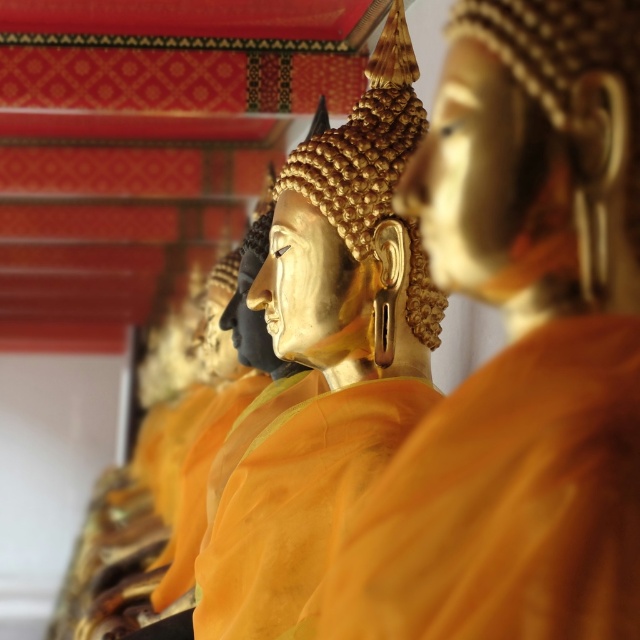
Question: Estimate the real-world distances between objects in this image. Which object is farther from the gold polished statue at center?

Choices:
 (A) matte orange fabric at center
 (B) gold shiny monk at center

Answer: (B)

Question: From the image, what is the correct spatial relationship of gold shiny monk at center in relation to matte orange fabric at center?

Choices:
 (A) right
 (B) left

Answer: (A)

Question: Is gold shiny monk at center thinner than matte orange fabric at center?

Choices:
 (A) yes
 (B) no

Answer: (A)

Question: Which of these objects is positioned farthest from the gold polished statue at center?

Choices:
 (A) matte orange fabric at center
 (B) gold shiny monk at center

Answer: (B)

Question: Is gold shiny monk at center closer to camera compared to matte orange fabric at center?

Choices:
 (A) no
 (B) yes

Answer: (B)

Question: Which of the following is the farthest from the observer?

Choices:
 (A) (324, 538)
 (B) (625, 410)

Answer: (A)